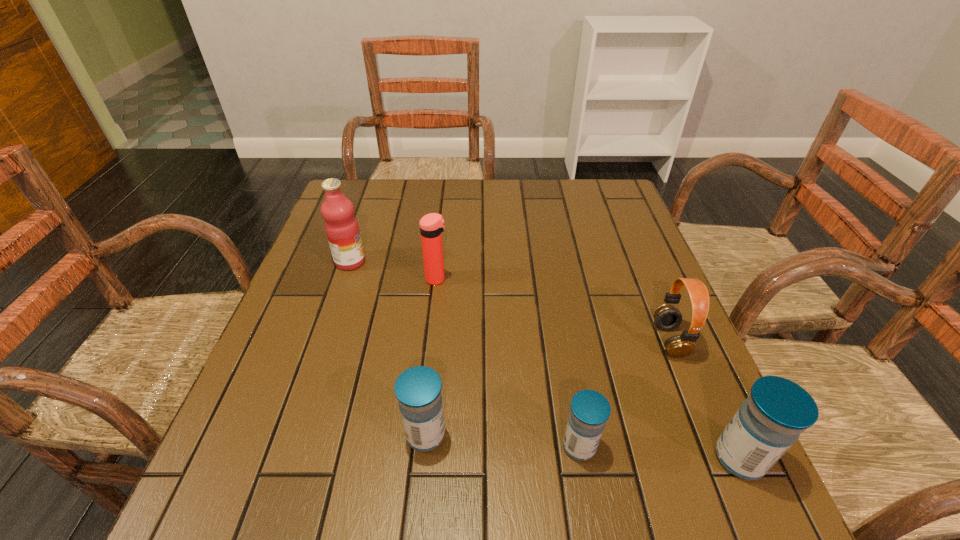
Please point a vacant point for placing a medicine on the left. Please provide its 2D coordinates. Your answer should be formatted as a tuple, i.e. [(x, y)], where the tuple contains the x and y coordinates of a point satisfying the conditions above.

[(278, 423)]